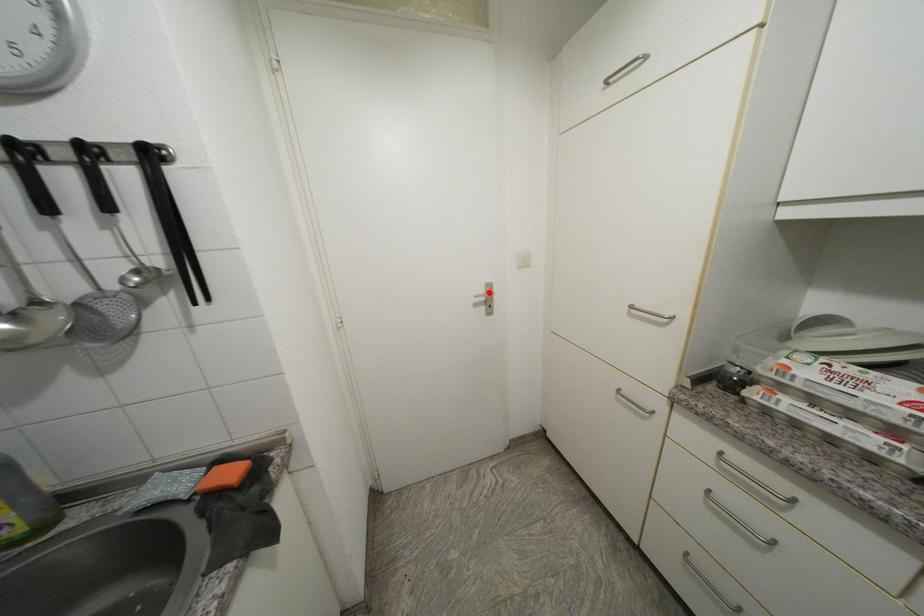
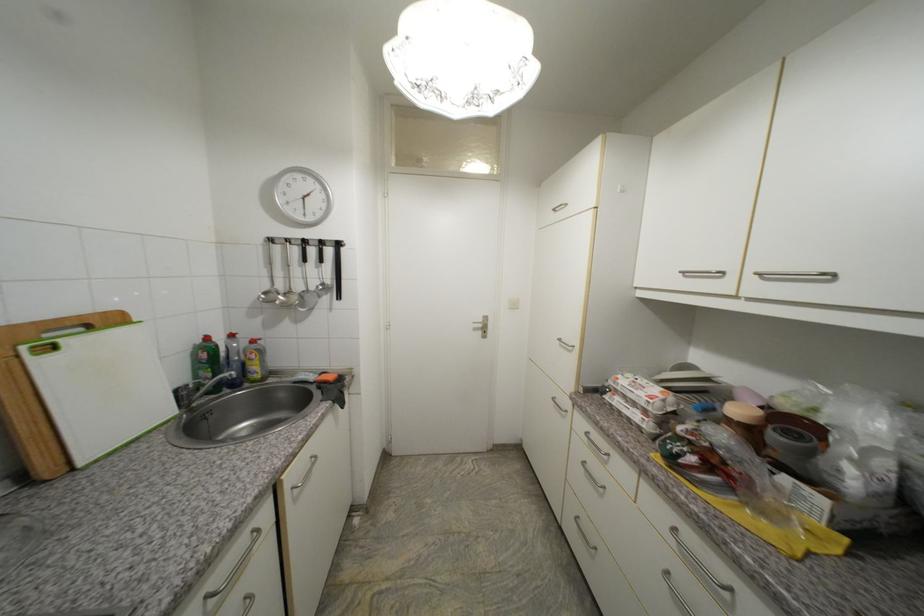
The point at the highlighted location is marked in the first image. Where is the corresponding point in the second image?

(487, 322)